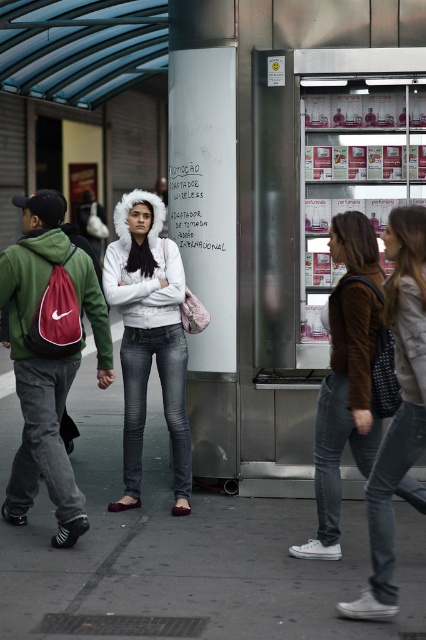
Question: Which point is closer to the camera?

Choices:
 (A) (34, 534)
 (B) (66, 500)
 (C) (350, 410)
 (D) (143, 292)

Answer: (C)

Question: Can you confirm if smooth concrete pavement at center is positioned to the right of white fur-lined jacket at center?

Choices:
 (A) no
 (B) yes

Answer: (B)

Question: Which object appears farthest from the camera in this image?

Choices:
 (A) red fabric backpack at left
 (B) white fur-lined jacket at center

Answer: (B)

Question: Can you confirm if smooth concrete pavement at center is positioned below red fabric backpack at left?

Choices:
 (A) yes
 (B) no

Answer: (A)

Question: Does smooth concrete pavement at center appear on the left side of red fabric backpack at left?

Choices:
 (A) no
 (B) yes

Answer: (A)

Question: Which point is farther from the camera taking this photo?

Choices:
 (A) (348, 371)
 (B) (160, 225)
 (C) (54, 320)

Answer: (B)